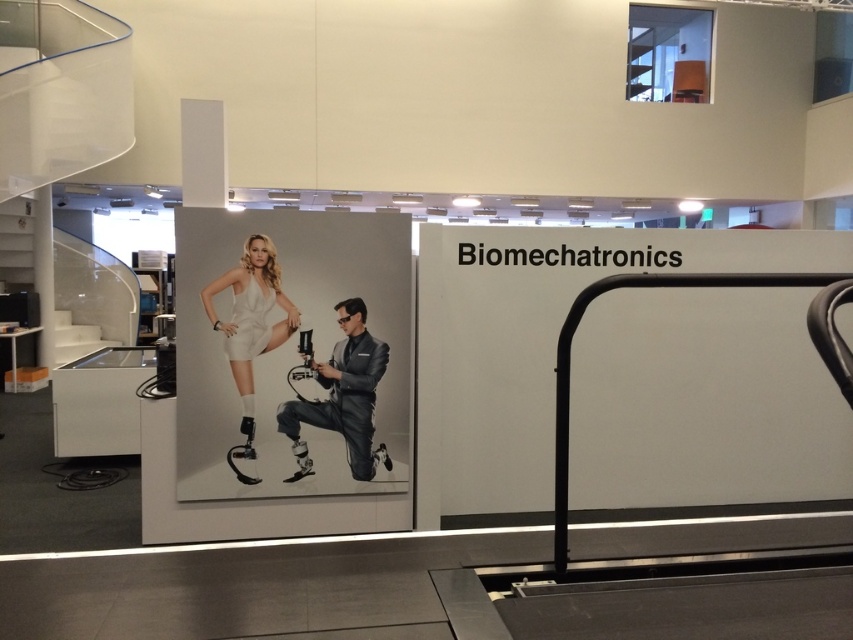
Question: Does black metal rail at right have a lesser width compared to shiny metallic suit at center?

Choices:
 (A) yes
 (B) no

Answer: (B)

Question: Which of the following is the farthest from the observer?

Choices:
 (A) white matte dress at center
 (B) white glossy stair at left
 (C) shiny metallic suit at center
 (D) black metal rail at right

Answer: (B)

Question: Considering the relative positions of black metal rail at right and white matte dress at center in the image provided, where is black metal rail at right located with respect to white matte dress at center?

Choices:
 (A) left
 (B) right

Answer: (B)

Question: Is shiny metallic suit at center thinner than white matte dress at center?

Choices:
 (A) no
 (B) yes

Answer: (A)

Question: Which is nearer to the white glossy stair at left?

Choices:
 (A) shiny metallic suit at center
 (B) black metal rail at right
 (C) white matte dress at center

Answer: (C)

Question: Which point is closer to the camera?

Choices:
 (A) white glossy stair at left
 (B) shiny metallic suit at center
 (C) white matte dress at center
 (D) black metal rail at right

Answer: (D)